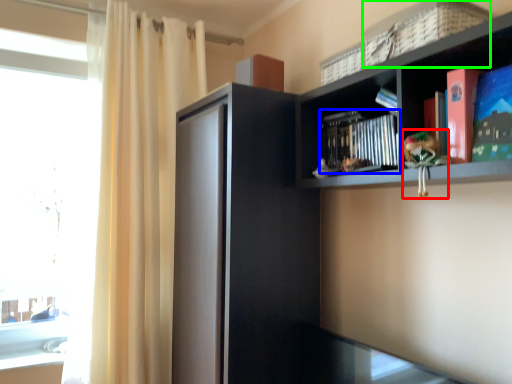
Question: Based on their relative distances, which object is farther from toy (highlighted by a red box)? Choose from book (highlighted by a blue box) and basket (highlighted by a green box).

Choices:
 (A) book
 (B) basket

Answer: (B)